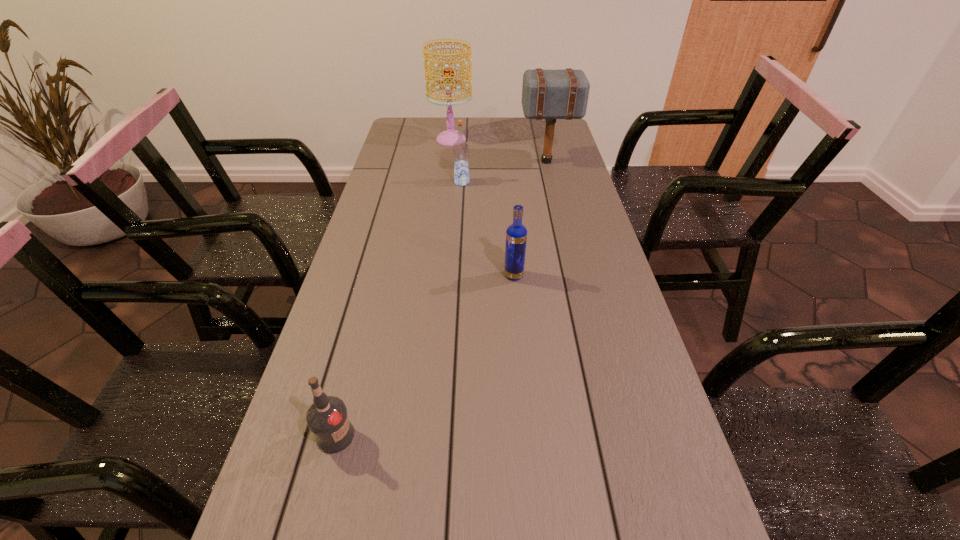
Where is `free space between the lampshade and the rightmost vodka`? free space between the lampshade and the rightmost vodka is located at coordinates (483, 207).

At what (x,y) coordinates should I click in order to perform the action: click on unoccupied area between the shortest vodka and the farthest object. Please return your answer as a coordinate pair (x, y). This screenshot has height=540, width=960. Looking at the image, I should click on (394, 288).

The image size is (960, 540). What are the coordinates of `free space between the second nearest vodka and the farthest object` in the screenshot? It's located at (483, 207).

Find the location of a particular element. vacant point located between the rightmost object and the leftmost object is located at coordinates (442, 299).

Identify which object is the closest to the leftmost object. Please provide its 2D coordinates. Your answer should be formatted as a tuple, i.e. [(x, y)], where the tuple contains the x and y coordinates of a point satisfying the conditions above.

[(516, 235)]

At what (x,y) coordinates should I click in order to perform the action: click on object that is the second closest one to the farthest vodka. Please return your answer as a coordinate pair (x, y). The image size is (960, 540). Looking at the image, I should click on (450, 136).

Point out which vodka is positioned as the second nearest to the farthest vodka. Please provide its 2D coordinates. Your answer should be formatted as a tuple, i.e. [(x, y)], where the tuple contains the x and y coordinates of a point satisfying the conditions above.

[(327, 418)]

Locate which vodka ranks second in proximity to the rightmost vodka. Please provide its 2D coordinates. Your answer should be formatted as a tuple, i.e. [(x, y)], where the tuple contains the x and y coordinates of a point satisfying the conditions above.

[(327, 418)]

This screenshot has width=960, height=540. I want to click on blank space that satisfies the following two spatial constraints: 1. on the front side of the second vodka from right to left; 2. on the front label of the leftmost vodka, so click(447, 436).